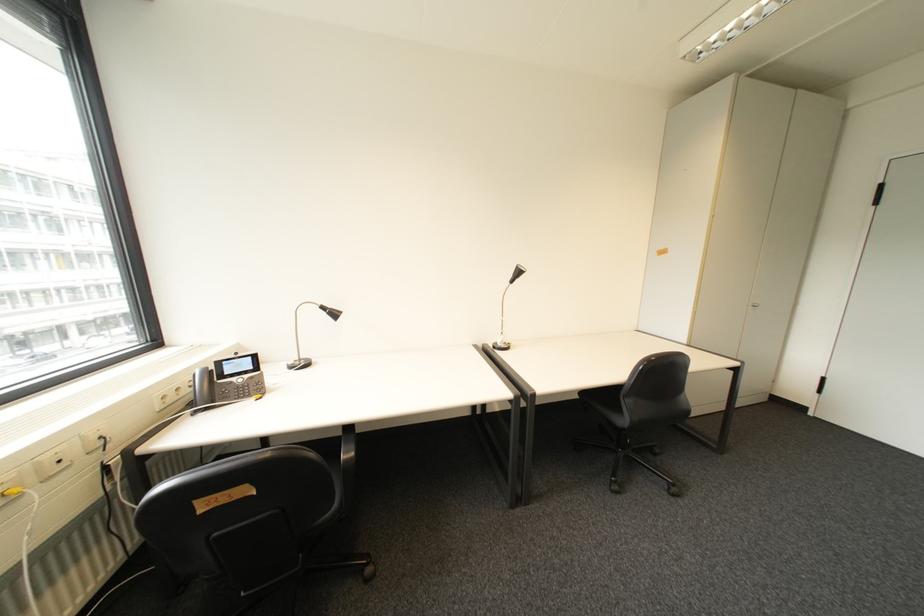
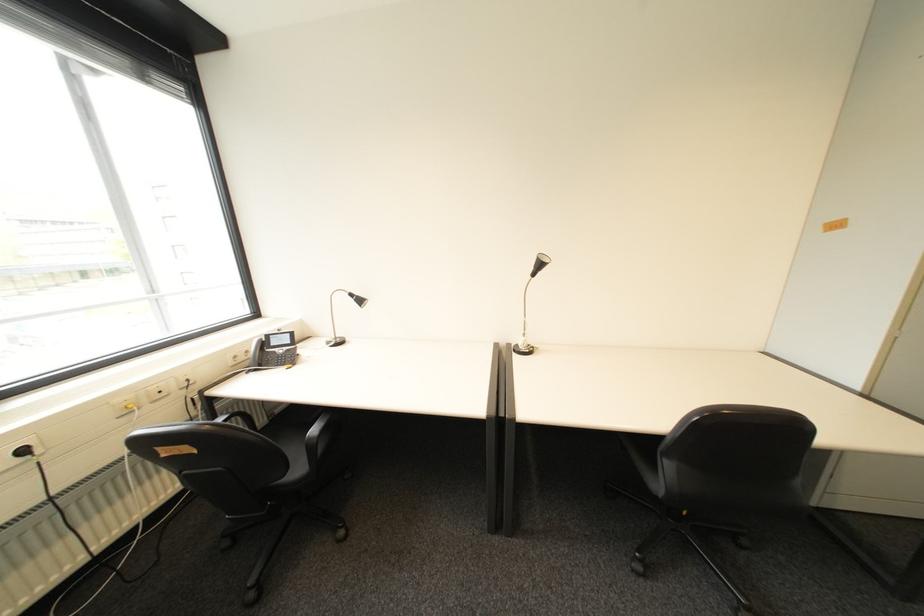
In the second image, find the point that corresponds to the point at 334,314 in the first image.

(362, 301)